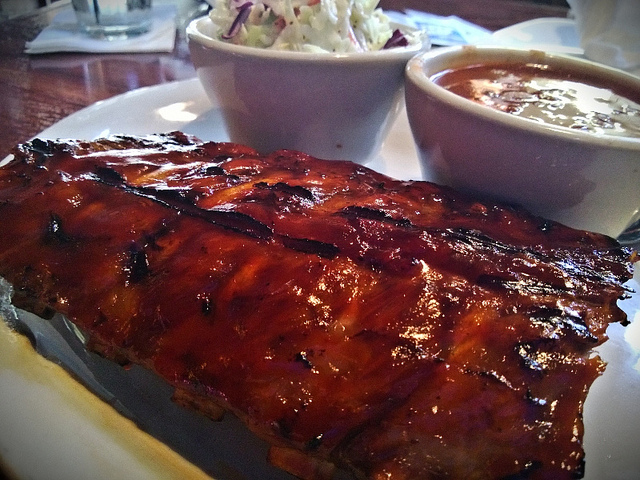
You are a GUI agent. You are given a task and a screenshot of the screen. Output one action in this format:
    pyautogui.click(x=<x>, y=<y>)
    Task: Click on the wooden table behind plate
    This screenshot has height=480, width=640.
    Given the screenshot: What is the action you would take?
    pyautogui.click(x=57, y=85)